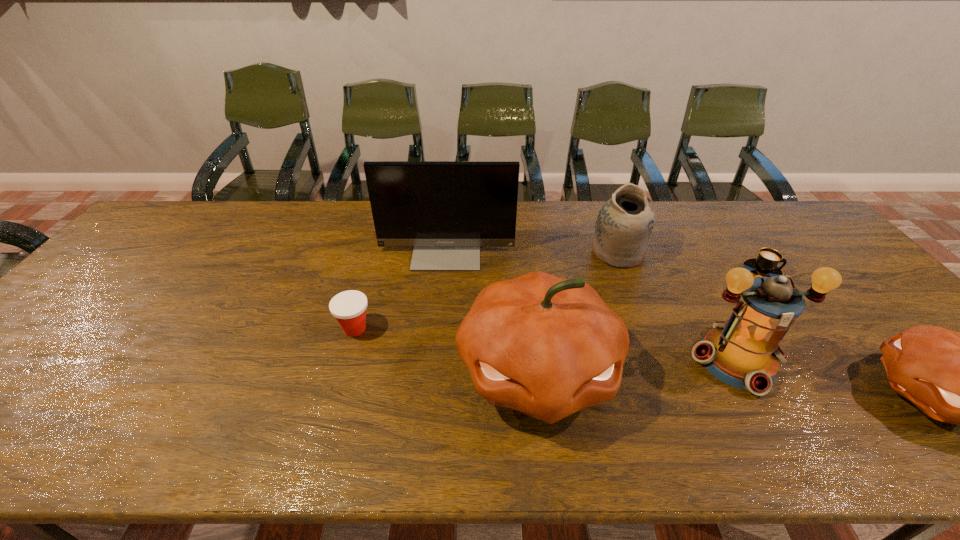
The pumpkins are evenly distributed in the image. To maintain this, where would you place another pumpkin on the left? Please point to a free space. Please provide its 2D coordinates. Your answer should be formatted as a tuple, i.e. [(x, y)], where the tuple contains the x and y coordinates of a point satisfying the conditions above.

[(180, 349)]